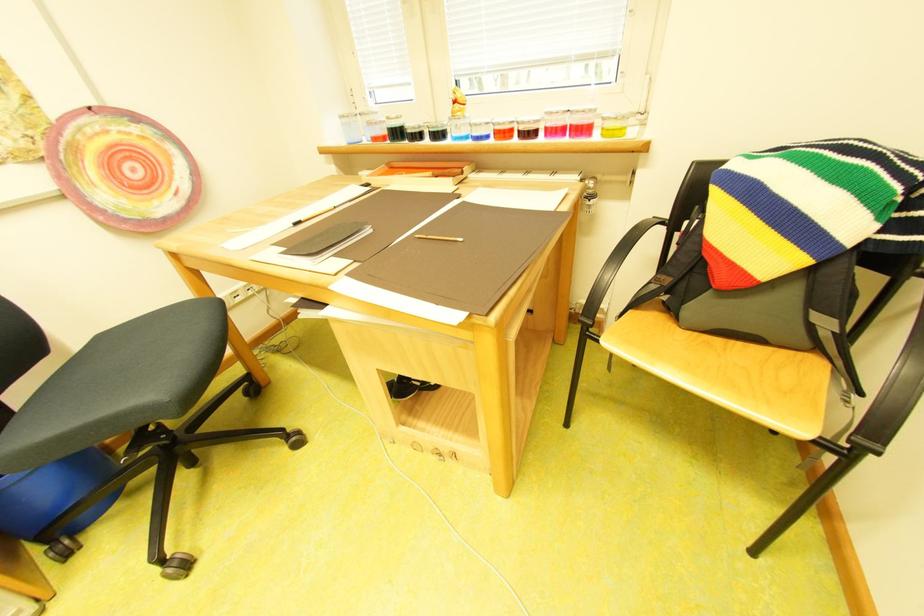
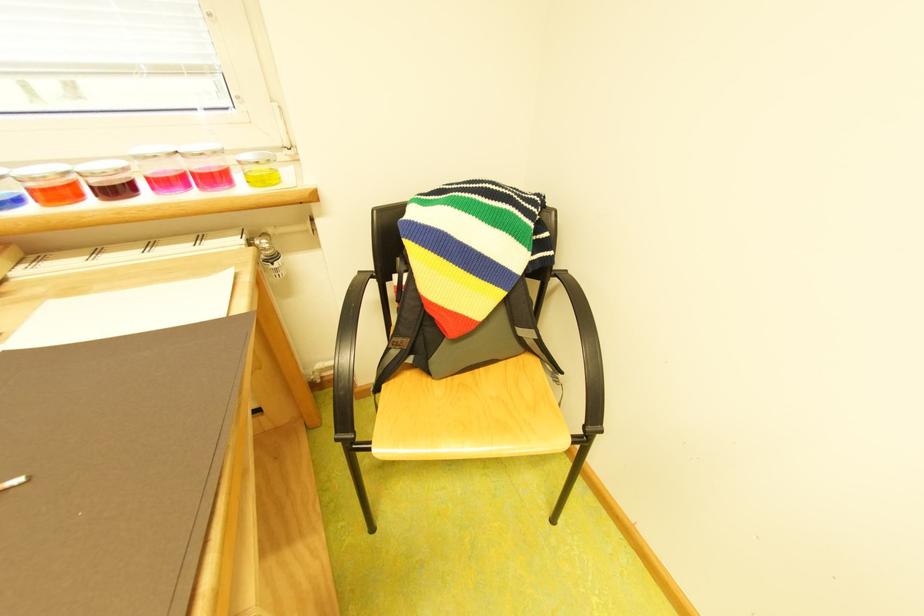
Question: The camera is either moving clockwise (left) or counter-clockwise (right) around the object. The first image is from the beginning of the video and the second image is from the end. Is the camera moving left or right when shooting the video?

Choices:
 (A) Left
 (B) Right

Answer: (A)